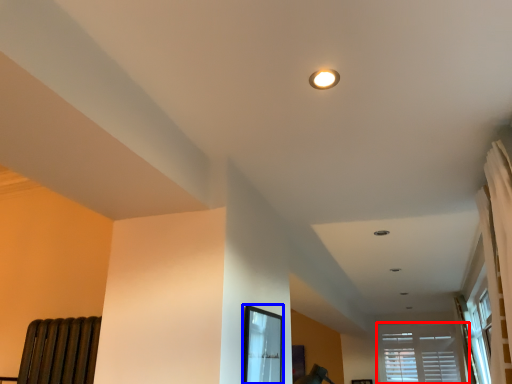
Question: Among these objects, which one is farthest to the camera, window (highlighted by a red box) or bay window (highlighted by a blue box)?

Choices:
 (A) window
 (B) bay window

Answer: (A)